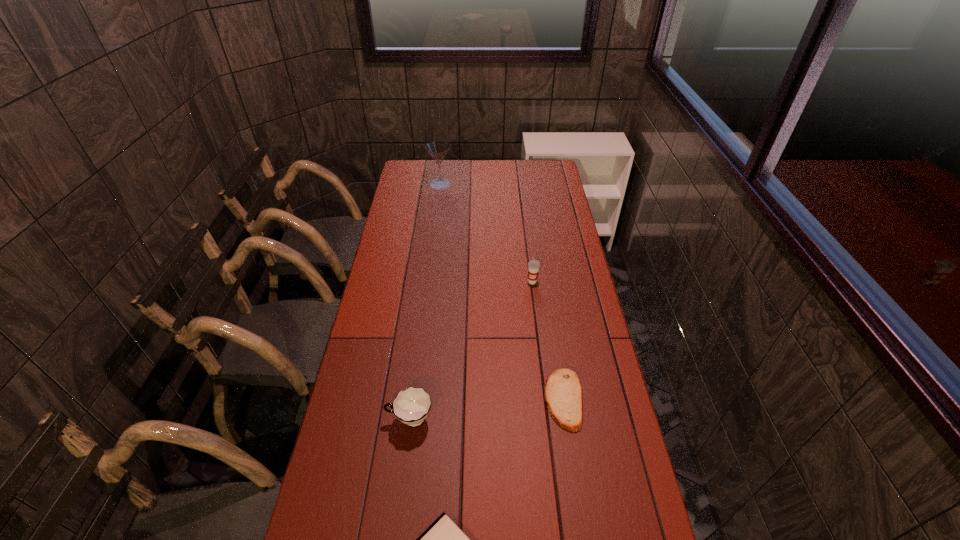
In order to click on vacant space at the right edge of the desktop in this screenshot , I will do `click(538, 238)`.

Locate an element on the screen. This screenshot has width=960, height=540. vacant space that is in between the tallest object and the farther cup is located at coordinates (486, 233).

The height and width of the screenshot is (540, 960). Identify the location of vacant space that is in between the pita bread and the nearer cup. (487, 409).

Where is `vacant region between the fourth tallest object and the tallest object`? vacant region between the fourth tallest object and the tallest object is located at coordinates (502, 292).

Identify the location of blank region between the fourth nearest object and the farthest object. The height and width of the screenshot is (540, 960). (486, 233).

The width and height of the screenshot is (960, 540). What are the coordinates of `free point between the flute glass and the fourth shortest object` in the screenshot? It's located at (486, 233).

Locate an element on the screen. The width and height of the screenshot is (960, 540). free space between the farthest object and the shorter cup is located at coordinates (425, 302).

Locate an element on the screen. Image resolution: width=960 pixels, height=540 pixels. the fourth closest object to the taller cup is located at coordinates (443, 539).

Choose which object is the third nearest neighbor to the taller cup. Please provide its 2D coordinates. Your answer should be formatted as a tuple, i.e. [(x, y)], where the tuple contains the x and y coordinates of a point satisfying the conditions above.

[(437, 149)]

At what (x,y) coordinates should I click in order to perform the action: click on vacant point that satisfies the following two spatial constraints: 1. on the side of the taller cup with the logo; 2. on the left side of the fourth tallest object. Please return your answer as a coordinate pair (x, y). Looking at the image, I should click on (547, 399).